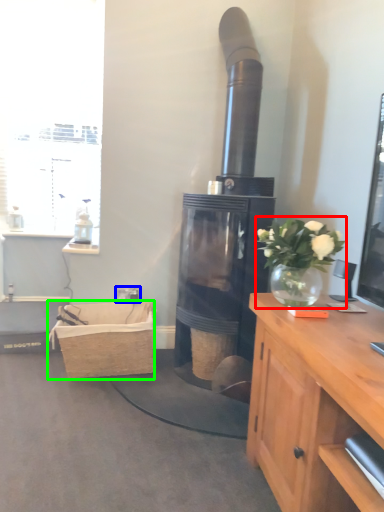
Question: Which object is positioned farthest from houseplant (highlighted by a red box)? Select from power outlet (highlighted by a blue box) and picnic basket (highlighted by a green box).

Choices:
 (A) power outlet
 (B) picnic basket

Answer: (A)